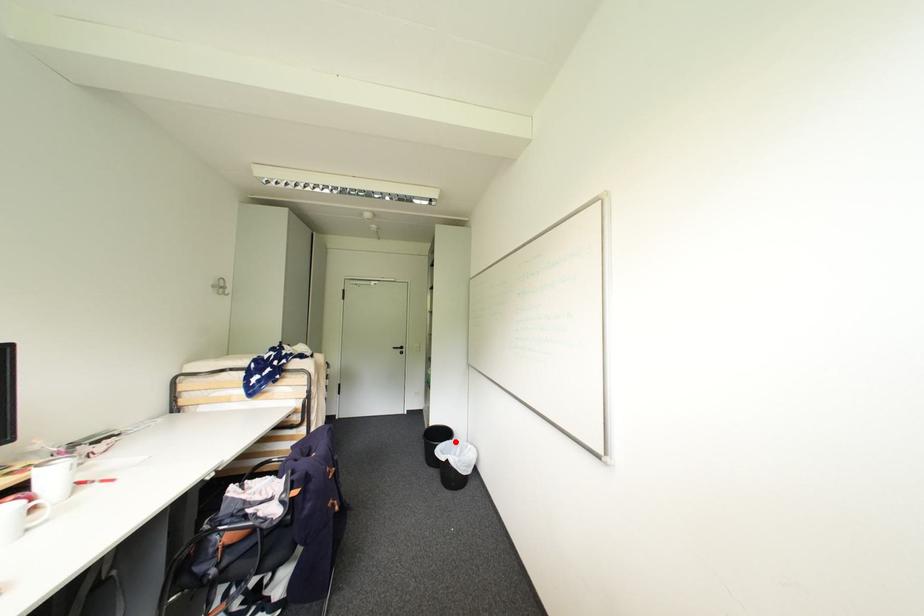
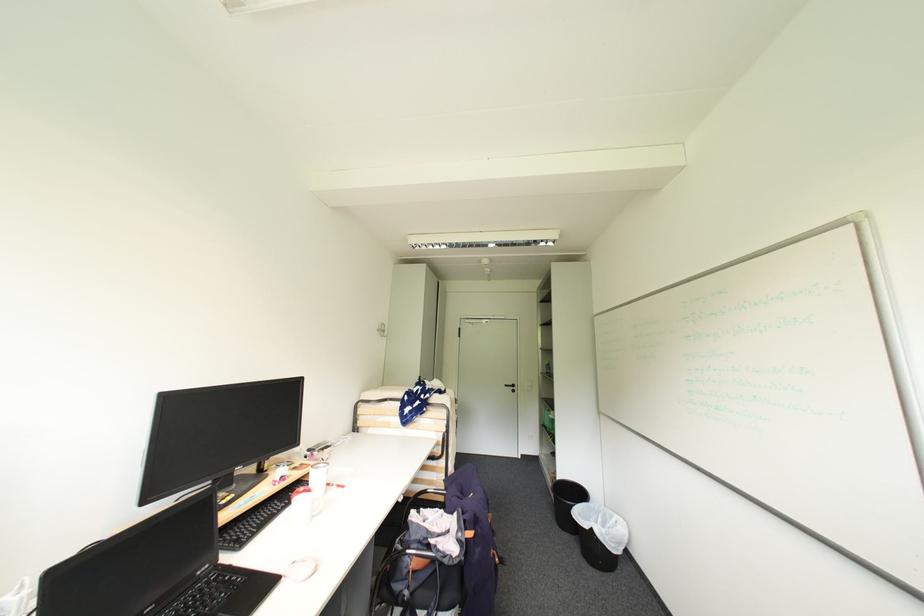
Where in the second image is the point corresponding to the highlighted location from the first image?

(591, 505)